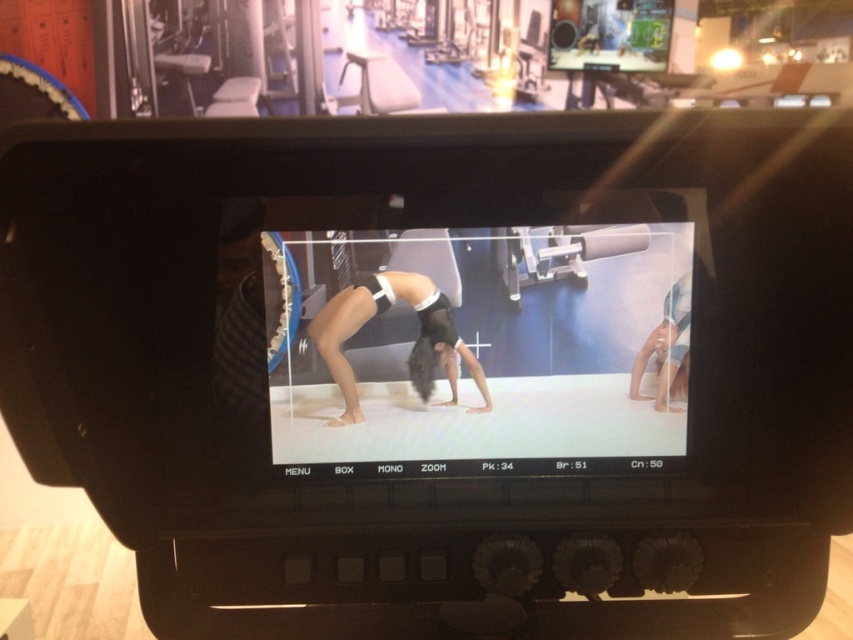
You are filming a fitness tutorial and need to ensure that both the black matte yoga mat at center and the black matte hair at center are clearly visible in the frame. Given that your camera has a minimum focus distance of 2 inches, will both objects remain in focus?

The black matte yoga mat at center and black matte hair at center are 2.01 inches apart, so they are just beyond the camera minimum focus distance of 2 inches. Both objects will remain in focus.

You are a fitness instructor reviewing a video of a student performing an exercise. The video shows the student on the black matte yoga mat at center and their body part at smooth skin at lower right. Based on the video frame, which object is positioned higher up in the image?

The black matte yoga mat at center is taller than smooth skin at lower right, so the black matte yoga mat at center is positioned higher up in the image.